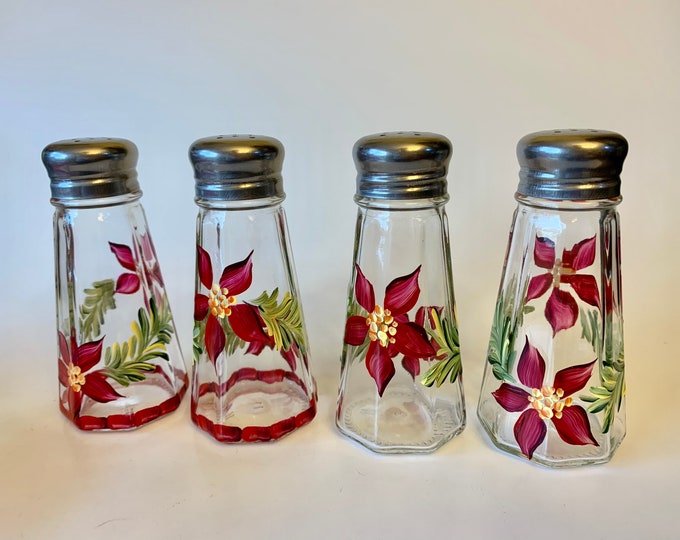
Find the location of a particular element. white center pedestals is located at coordinates (547, 403).